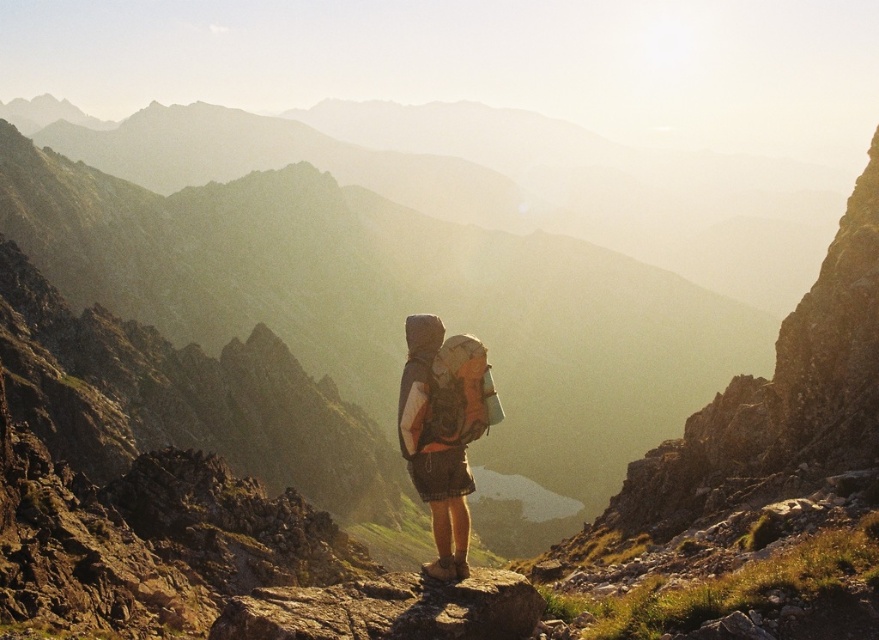
Question: Does rusty rock at center appear under matte gray backpack at center?

Choices:
 (A) no
 (B) yes

Answer: (B)

Question: Can you confirm if rusty rock at center is positioned below matte gray backpack at center?

Choices:
 (A) no
 (B) yes

Answer: (B)

Question: Is rusty rock at center positioned in front of matte gray backpack at center?

Choices:
 (A) no
 (B) yes

Answer: (B)

Question: Which point appears closest to the camera in this image?

Choices:
 (A) (405, 416)
 (B) (525, 634)

Answer: (B)